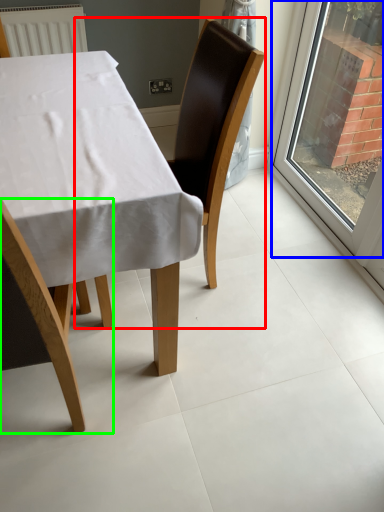
Question: Which object is positioned farthest from chair (highlighted by a red box)? Select from window (highlighted by a blue box) and chair (highlighted by a green box).

Choices:
 (A) window
 (B) chair

Answer: (A)